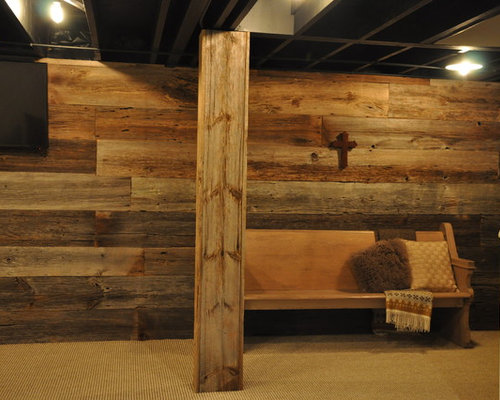
Where is `pillow`? The width and height of the screenshot is (500, 400). pillow is located at coordinates (387, 268), (432, 267).